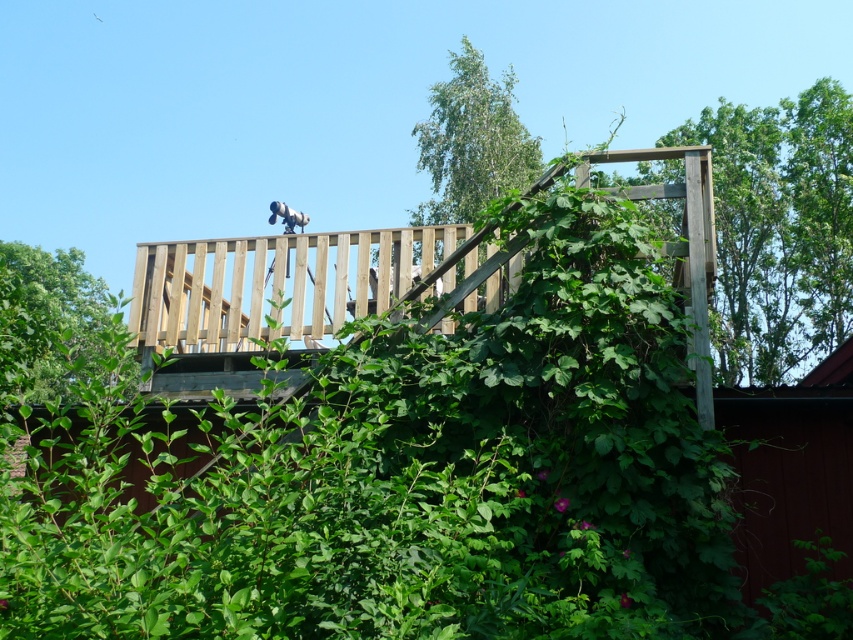
Question: Which of the following is the closest to the observer?

Choices:
 (A) green leafy tree at upper right
 (B) green leafy tree at upper center

Answer: (B)

Question: From the image, what is the correct spatial relationship of wooden at upper center in relation to green leafy tree at upper right?

Choices:
 (A) left
 (B) right

Answer: (A)

Question: Which point appears closest to the camera in this image?

Choices:
 (A) (308, 278)
 (B) (36, 374)

Answer: (A)

Question: Which of the following is the closest to the observer?

Choices:
 (A) (328, 257)
 (B) (26, 352)

Answer: (A)

Question: From the image, what is the correct spatial relationship of green leafy tree at upper right in relation to green leafy tree at upper center?

Choices:
 (A) above
 (B) below

Answer: (A)

Question: Is green leafy tree at upper right to the right of green leafy tree at upper center from the viewer's perspective?

Choices:
 (A) no
 (B) yes

Answer: (B)